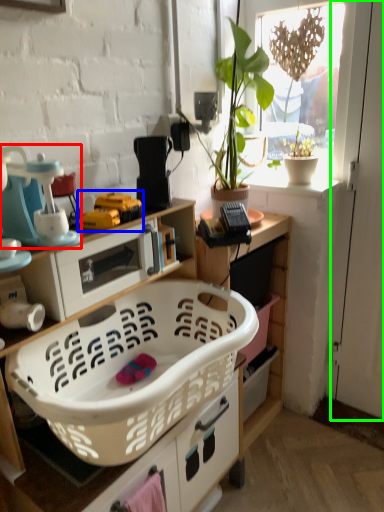
Question: Which object is positioned farthest from appliance (highlighted by a red box)? Select from toy (highlighted by a blue box) and screen door (highlighted by a green box).

Choices:
 (A) toy
 (B) screen door

Answer: (B)